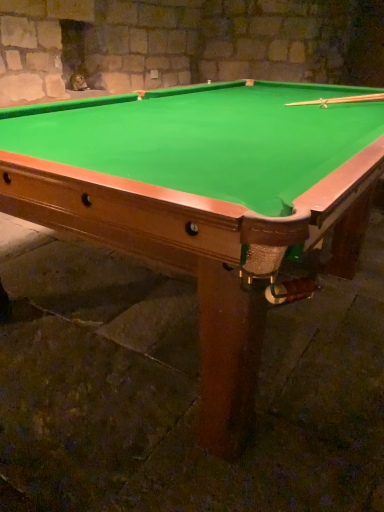
Question: Can you confirm if green felt pool table at center is taller than wooden cue at upper right?

Choices:
 (A) yes
 (B) no

Answer: (A)

Question: Would you say wooden cue at upper right is part of green felt pool table at center's contents?

Choices:
 (A) no
 (B) yes

Answer: (B)

Question: Is green felt pool table at center next to wooden cue at upper right?

Choices:
 (A) no
 (B) yes

Answer: (A)

Question: Considering the relative sizes of green felt pool table at center and wooden cue at upper right in the image provided, is green felt pool table at center wider than wooden cue at upper right?

Choices:
 (A) yes
 (B) no

Answer: (A)

Question: Could you tell me if green felt pool table at center is facing wooden cue at upper right?

Choices:
 (A) no
 (B) yes

Answer: (A)

Question: Can you confirm if green felt pool table at center is positioned to the left of wooden cue at upper right?

Choices:
 (A) yes
 (B) no

Answer: (A)

Question: Does wooden cue at upper right have a lesser width compared to green felt pool table at center?

Choices:
 (A) no
 (B) yes

Answer: (B)

Question: Is wooden cue at upper right far from green felt pool table at center?

Choices:
 (A) yes
 (B) no

Answer: (A)

Question: Does wooden cue at upper right have a larger size compared to green felt pool table at center?

Choices:
 (A) yes
 (B) no

Answer: (B)

Question: Does wooden cue at upper right appear on the right side of green felt pool table at center?

Choices:
 (A) yes
 (B) no

Answer: (A)

Question: Considering the relative sizes of wooden cue at upper right and green felt pool table at center in the image provided, is wooden cue at upper right taller than green felt pool table at center?

Choices:
 (A) yes
 (B) no

Answer: (B)

Question: From a real-world perspective, is wooden cue at upper right on top of green felt pool table at center?

Choices:
 (A) no
 (B) yes

Answer: (B)

Question: From a real-world perspective, is wooden cue at upper right above or below green felt pool table at center?

Choices:
 (A) above
 (B) below

Answer: (A)